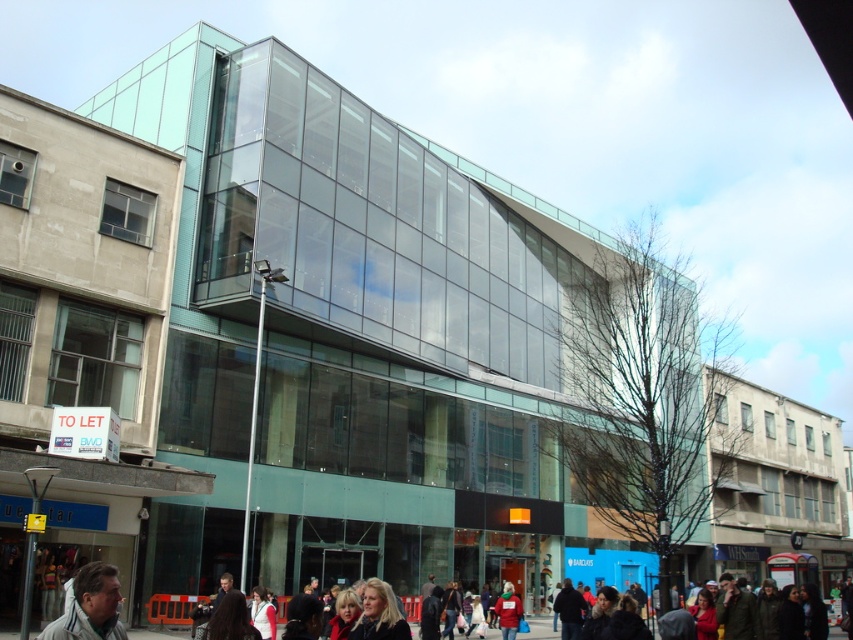
Measure the distance between point (47, 627) and camera.

The distance of point (47, 627) from camera is 77.26 feet.

This screenshot has width=853, height=640. What do you see at coordinates (90, 605) in the screenshot?
I see `gray fabric jacket at lower left` at bounding box center [90, 605].

Is point (86, 566) in front of point (364, 605)?

Yes, it is.

Find the location of a particular element. This screenshot has width=853, height=640. gray fabric jacket at lower left is located at coordinates (90, 605).

Which is in front, point (361, 632) or point (517, 625)?

Point (361, 632)

Between blonde hair at lower center and red knit hat at lower center, which one has more height?

With more height is blonde hair at lower center.

At what (x,y) coordinates should I click in order to perform the action: click on blonde hair at lower center. Please return your answer as a coordinate pair (x, y). This screenshot has height=640, width=853. Looking at the image, I should click on (x=379, y=614).

Does gray fabric jacket at lower left appear on the right side of red knit hat at lower center?

Incorrect, gray fabric jacket at lower left is not on the right side of red knit hat at lower center.

Who is more forward, (90, 576) or (515, 621)?

Positioned in front is point (90, 576).

Locate an element on the screen. gray fabric jacket at lower left is located at coordinates (90, 605).